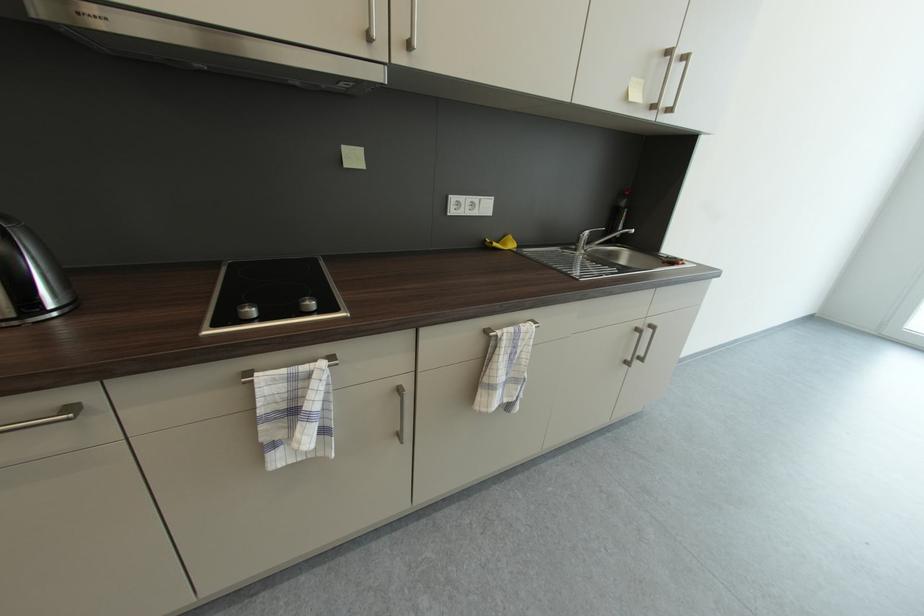
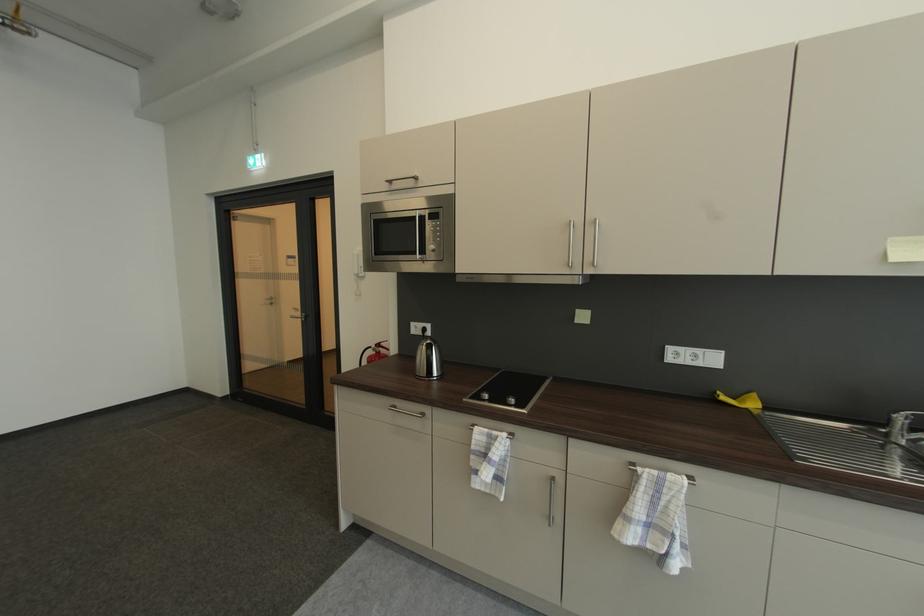
In the second image, find the point that corresponds to the point at 579,248 in the first image.

(892, 432)